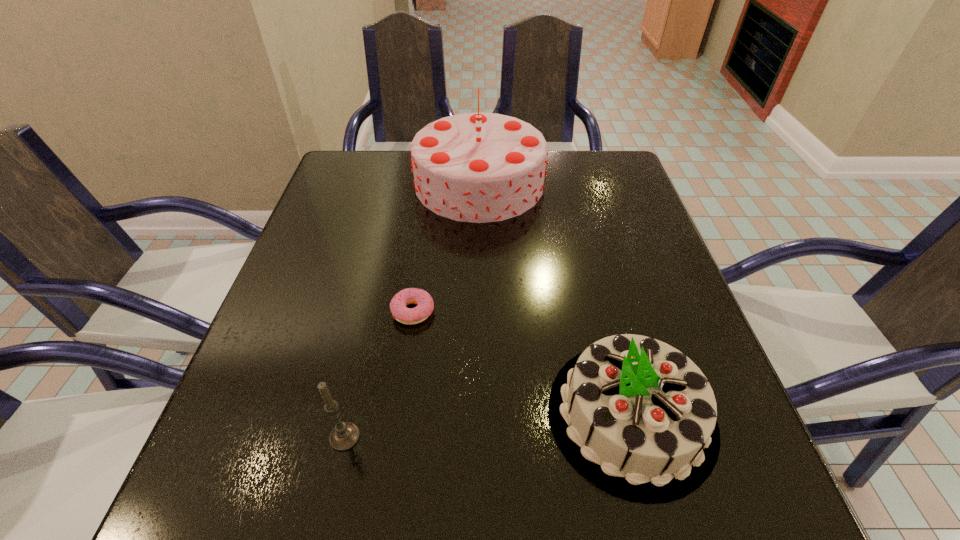
What are the coordinates of `vacant space located on the back of the doughnut` in the screenshot? It's located at (423, 238).

This screenshot has height=540, width=960. In order to click on object that is at the far edge in this screenshot , I will do `click(478, 167)`.

Where is `object at the near edge`? This screenshot has width=960, height=540. object at the near edge is located at coordinates (637, 417).

At what (x,y) coordinates should I click in order to perform the action: click on object at the right edge. Please return your answer as a coordinate pair (x, y). Looking at the image, I should click on (637, 417).

This screenshot has height=540, width=960. Identify the location of object at the near right corner. (637, 417).

I want to click on free space at the left edge, so click(x=243, y=375).

I want to click on vacant space at the right edge of the desktop, so click(621, 287).

At what (x,y) coordinates should I click in order to perform the action: click on free space at the near left corner. Please return your answer as a coordinate pair (x, y). This screenshot has height=540, width=960. Looking at the image, I should click on (248, 519).

The height and width of the screenshot is (540, 960). I want to click on vacant space at the far right corner of the desktop, so click(601, 181).

You are a GUI agent. You are given a task and a screenshot of the screen. Output one action in this format:
    pyautogui.click(x=<x>, y=<y>)
    Task: Click on the unoccupied position between the nearer birthday cake and the shortest object
    The height and width of the screenshot is (540, 960).
    Given the screenshot: What is the action you would take?
    pyautogui.click(x=522, y=363)